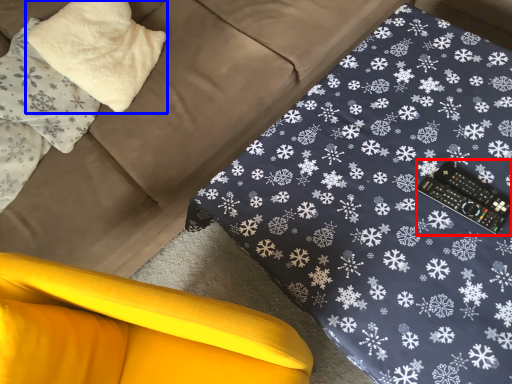
Question: Among these objects, which one is nearest to the camera, control (highlighted by a red box) or pillow (highlighted by a blue box)?

Choices:
 (A) control
 (B) pillow

Answer: (A)